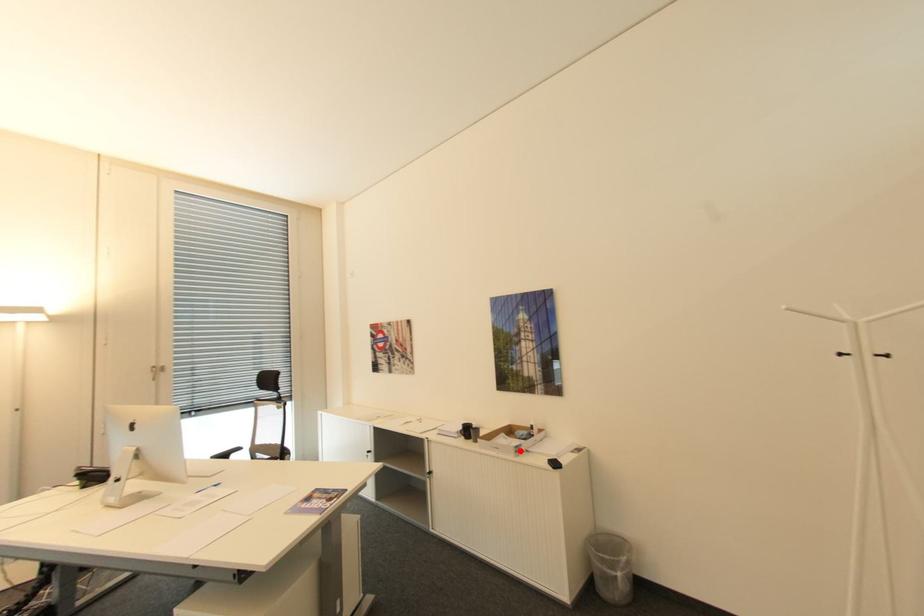
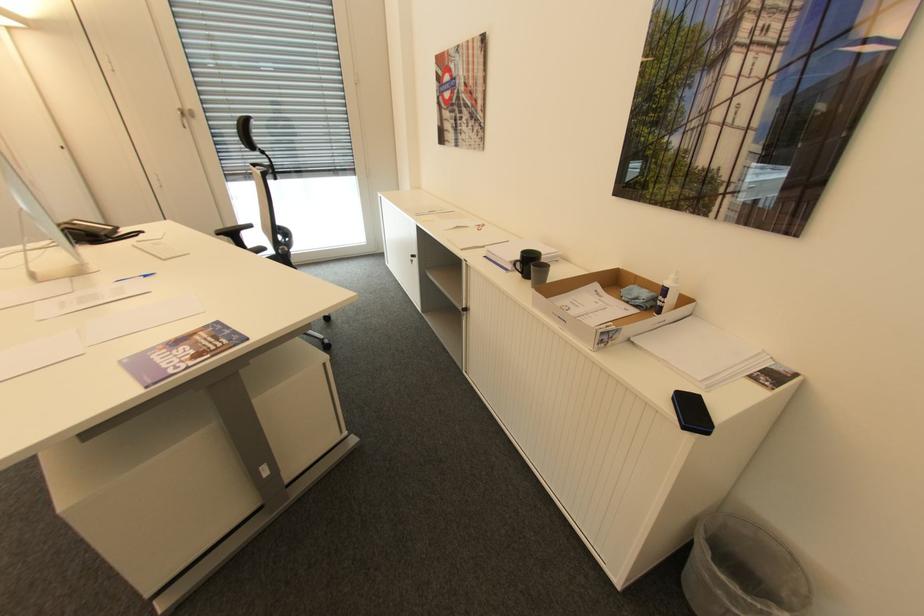
The point at the highlighted location is marked in the first image. Where is the corresponding point in the second image?

(606, 342)